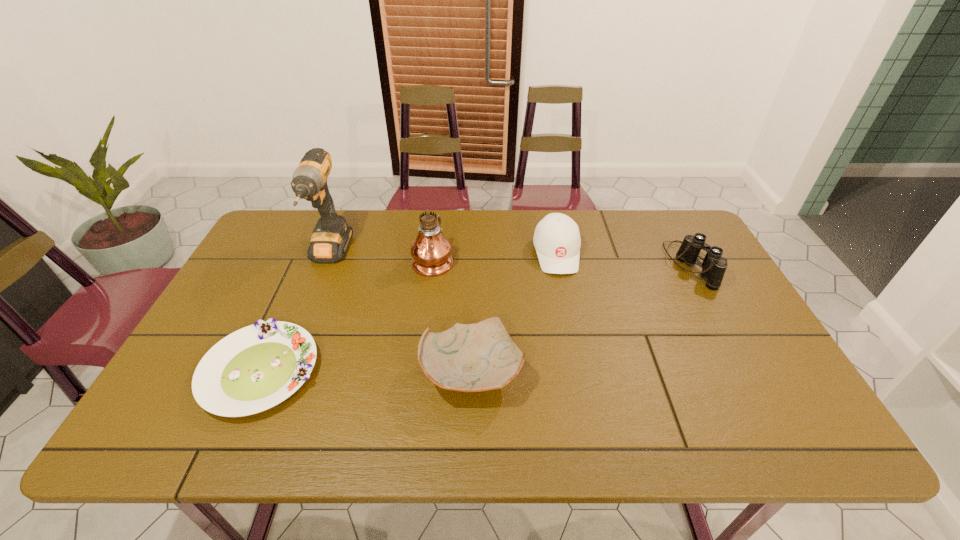
Locate an element on the screen. vacant area between the binoculars and the drill is located at coordinates (510, 260).

Identify the location of free space between the drill and the salad plate. This screenshot has width=960, height=540. (295, 313).

Locate an element on the screen. This screenshot has height=540, width=960. free space between the drill and the rightmost object is located at coordinates (510, 260).

You are a GUI agent. You are given a task and a screenshot of the screen. Output one action in this format:
    pyautogui.click(x=<x>, y=<y>)
    Task: Click on the empty space between the shortest object and the second shortest object
    
    Given the screenshot: What is the action you would take?
    pyautogui.click(x=367, y=372)

At what (x,y) coordinates should I click in order to perform the action: click on free area in between the second object from right to left and the binoculars. Please return your answer as a coordinate pair (x, y). The width and height of the screenshot is (960, 540). Looking at the image, I should click on (623, 260).

Locate an element on the screen. The image size is (960, 540). vacant point located between the pottery and the binoculars is located at coordinates (581, 319).

The height and width of the screenshot is (540, 960). I want to click on object that is the fifth closest one to the pottery, so click(714, 266).

You are a GUI agent. You are given a task and a screenshot of the screen. Output one action in this format:
    pyautogui.click(x=<x>, y=<y>)
    Task: Click on the object that is the fifth closest to the pottery
    This screenshot has width=960, height=540.
    Given the screenshot: What is the action you would take?
    pyautogui.click(x=714, y=266)

Where is `vacant space that satisfies the following two spatial constraints: 1. on the front-facing side of the rightmost object; 2. on the left side of the fifth object from left to right`? Image resolution: width=960 pixels, height=540 pixels. vacant space that satisfies the following two spatial constraints: 1. on the front-facing side of the rightmost object; 2. on the left side of the fifth object from left to right is located at coordinates (559, 266).

Where is `vacant space that satisfies the following two spatial constraints: 1. with the drill bit of the drill facing forward; 2. on the right side of the binoculars`? vacant space that satisfies the following two spatial constraints: 1. with the drill bit of the drill facing forward; 2. on the right side of the binoculars is located at coordinates (324, 266).